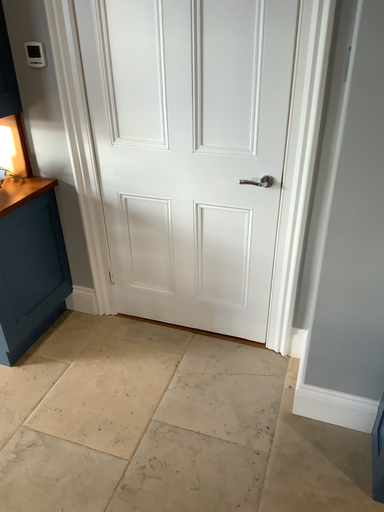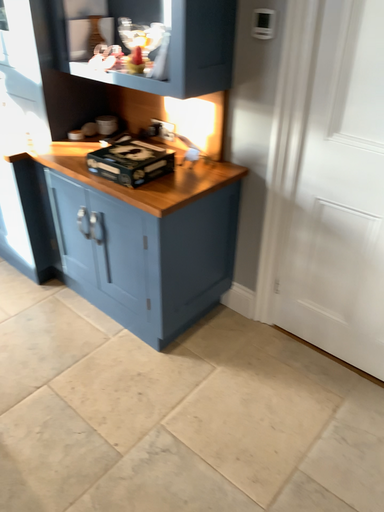
Question: Which way did the camera rotate in the video?

Choices:
 (A) rotated left
 (B) rotated right

Answer: (A)